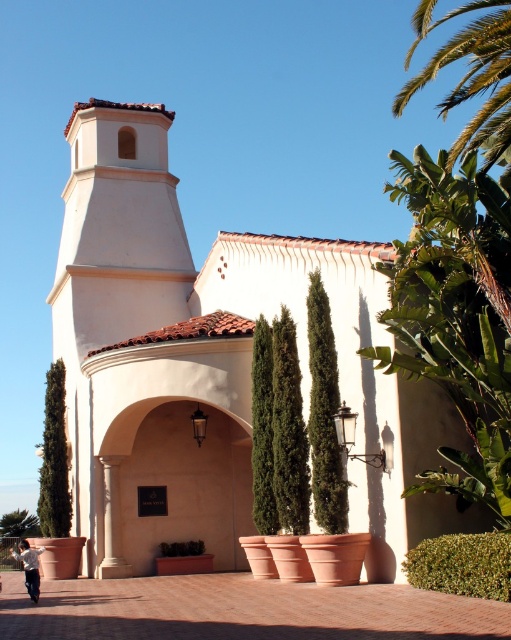
Between point (376, 314) and point (42, 461), which one is positioned in front?

Point (376, 314) is more forward.

Is point (134, 452) closer to viewer compared to point (43, 476)?

Yes, it is.

Where is `white stucco church at center`? The image size is (511, 640). white stucco church at center is located at coordinates (211, 362).

Which is behind, point (41, 500) or point (171, 556)?

Positioned behind is point (41, 500).

Is point (51, 460) positioned after point (200, 541)?

Yes, it is.

Find the location of a particular element. This screenshot has height=640, width=511. green textured bush at left is located at coordinates (55, 458).

Does green leafy bush at lower right have a greater height compared to green textured bush at left?

Incorrect, green leafy bush at lower right's height is not larger of green textured bush at left's.

What do you see at coordinates (461, 564) in the screenshot? This screenshot has width=511, height=640. I see `green leafy bush at lower right` at bounding box center [461, 564].

This screenshot has width=511, height=640. I want to click on green leafy bush at lower right, so click(461, 564).